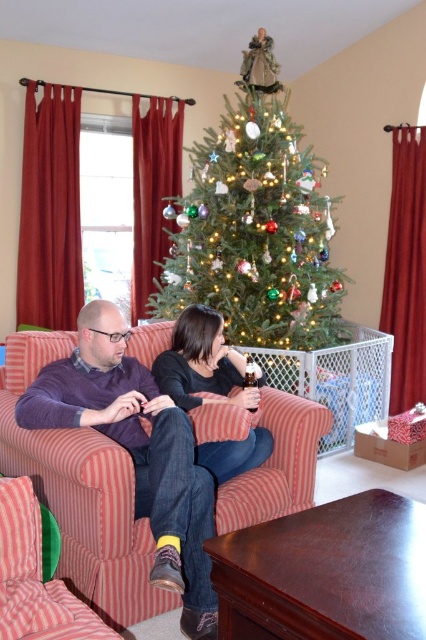
You are standing in the room and see the green matte christmas tree at center and the black matte shirt at center. Which object is positioned to the right from your perspective?

The green matte christmas tree at center is to the right of the black matte shirt at center.

You are sitting on the floor 6 feet away from the striped fabric couch at center. Can you reach the couch without moving your feet?

The distance between you and the striped fabric couch at center is 6.33 feet, which is slightly more than 6 feet. Therefore, you cannot reach the couch without moving your feet.